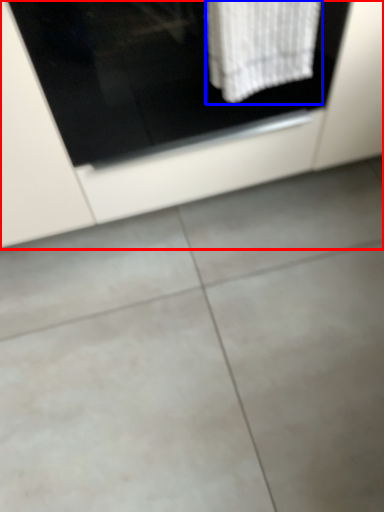
Question: Which of the following is the closest to the observer, cabinetry (highlighted by a red box) or bath towel (highlighted by a blue box)?

Choices:
 (A) cabinetry
 (B) bath towel

Answer: (B)